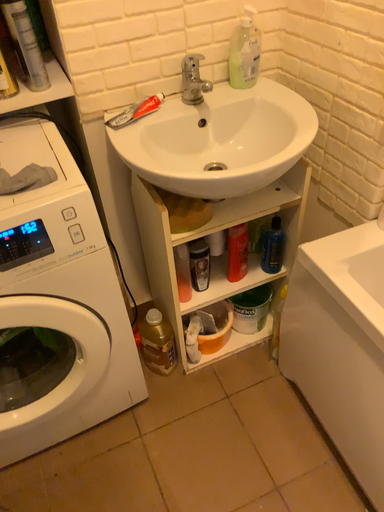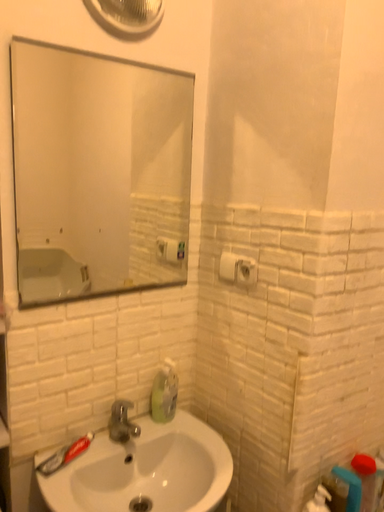
Question: Which way did the camera rotate in the video?

Choices:
 (A) rotated upward
 (B) rotated downward

Answer: (A)